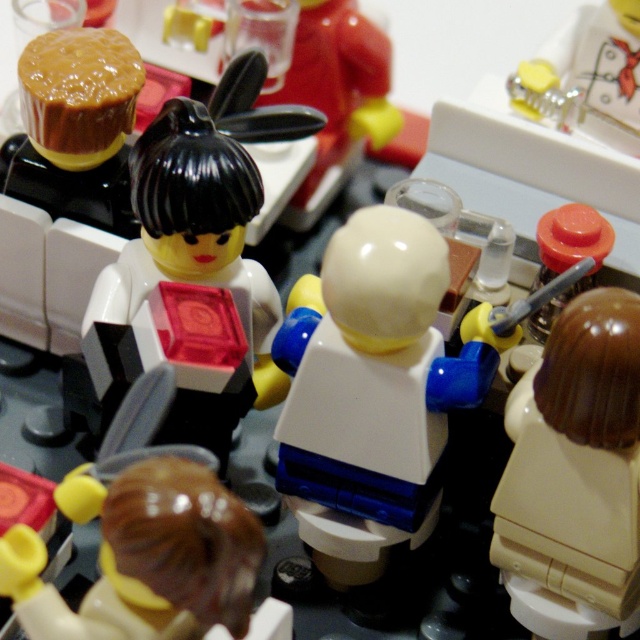
Question: Which is nearer to the black glossy minifigure at center?

Choices:
 (A) brown glossy hair at center
 (B) brown glossy hair at lower left
 (C) white plastic figure at center

Answer: (C)

Question: Can you confirm if brown glossy hair at center is smaller than translucent red cube at center?

Choices:
 (A) no
 (B) yes

Answer: (B)

Question: Which point is closer to the camera?

Choices:
 (A) (184, 248)
 (B) (276, 100)
 (C) (611, 536)
 (D) (195, 484)

Answer: (D)

Question: Is brown glossy hair at center to the right of brown glossy hair at lower left from the viewer's perspective?

Choices:
 (A) no
 (B) yes

Answer: (B)

Question: Where is brown glossy hair at center located in relation to translucent red cube at center in the image?

Choices:
 (A) right
 (B) left

Answer: (A)

Question: Which of the following is the farthest from the observer?

Choices:
 (A) brown glossy hair at center
 (B) black glossy minifigure at center
 (C) translucent red cube at center

Answer: (B)